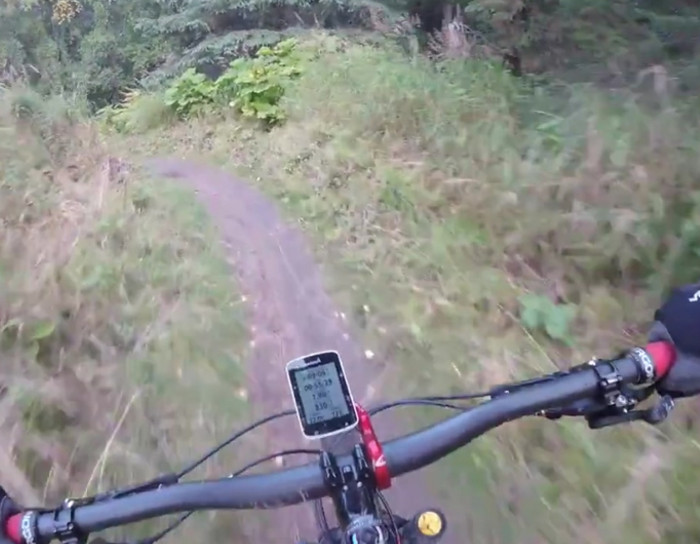
Identify the location of cables. (153, 531), (230, 428), (424, 400).